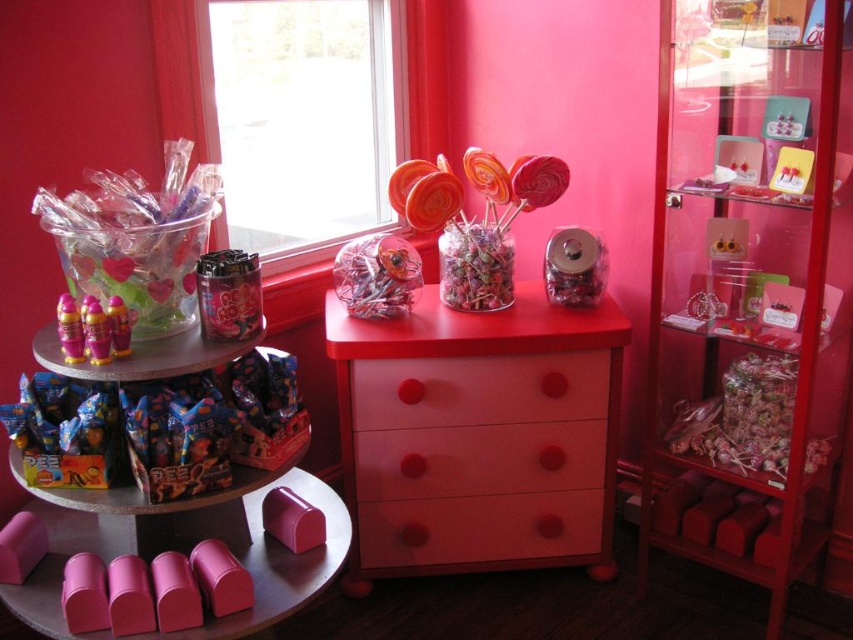
Looking at this image, can you confirm if matte plastic drawer at center is positioned to the right of pink matte table at lower center?

Correct, you'll find matte plastic drawer at center to the right of pink matte table at lower center.

Describe the element at coordinates (479, 388) in the screenshot. I see `matte plastic drawer at center` at that location.

Locate an element on the screen. This screenshot has width=853, height=640. matte plastic drawer at center is located at coordinates (479, 388).

Does pink matte table at lower center have a greater height compared to shiny metallic bottles at left?

Correct, pink matte table at lower center is much taller as shiny metallic bottles at left.

Based on the photo, can you confirm if pink matte table at lower center is positioned to the left of shiny metallic bottles at left?

No, pink matte table at lower center is not to the left of shiny metallic bottles at left.

The height and width of the screenshot is (640, 853). What are the coordinates of `pink matte table at lower center` in the screenshot? It's located at [x=280, y=563].

Find the location of a particular element. The width and height of the screenshot is (853, 640). pink matte table at lower center is located at coordinates (280, 563).

Between shiny plastic lollipops at center and translucent plastic lollipop at center, which one appears on the right side from the viewer's perspective?

shiny plastic lollipops at center

Describe the element at coordinates (474, 220) in the screenshot. Image resolution: width=853 pixels, height=640 pixels. I see `shiny plastic lollipops at center` at that location.

This screenshot has width=853, height=640. Describe the element at coordinates (474, 220) in the screenshot. I see `shiny plastic lollipops at center` at that location.

Where is `shiny plastic lollipops at center`? The height and width of the screenshot is (640, 853). shiny plastic lollipops at center is located at coordinates (474, 220).